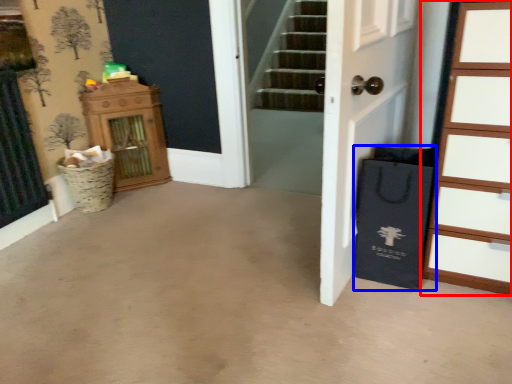
Question: Which object is closer to the camera taking this photo, chest of drawers (highlighted by a red box) or shopping bag (highlighted by a blue box)?

Choices:
 (A) chest of drawers
 (B) shopping bag

Answer: (A)